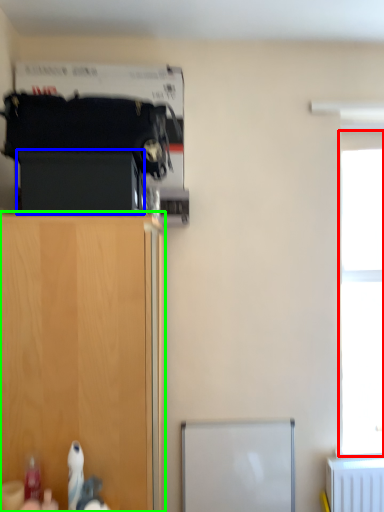
Question: Which object is the farthest from window (highlighted by a red box)? Choose among these: cabinetry (highlighted by a blue box) or cupboard (highlighted by a green box).

Choices:
 (A) cabinetry
 (B) cupboard

Answer: (A)